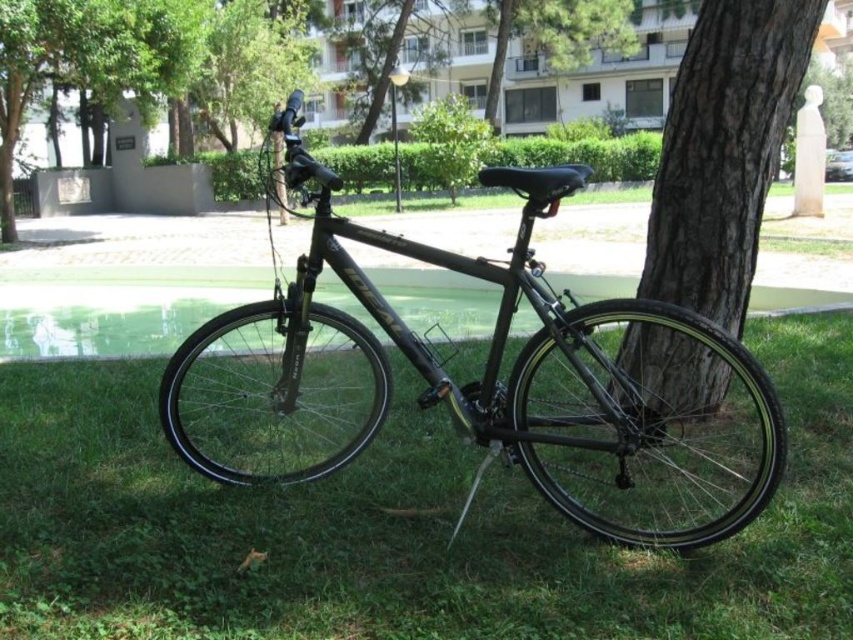
You are standing at the camera position and want to pick up an object. Which point, point (541, 547) or point (796, 10), is closer to you?

Point (541, 547) is closer to the camera than point (796, 10), so you should pick up the object at point (541, 547) first.

You are standing in the park and see two points marked on the ground near the bike. The first point is at coordinates point (x=735, y=348) and the second is at point (x=693, y=81). Which point is closer to you?

Point (x=735, y=348) is closer to the camera than point (x=693, y=81), so the first point is closer to you.

You are standing at the point marked by the coordinate point at [463,385]. What object is directly in front of you?

The point at [463,385] marks the matte black bicycle at center, so the object directly in front of you is the matte black bicycle at center.